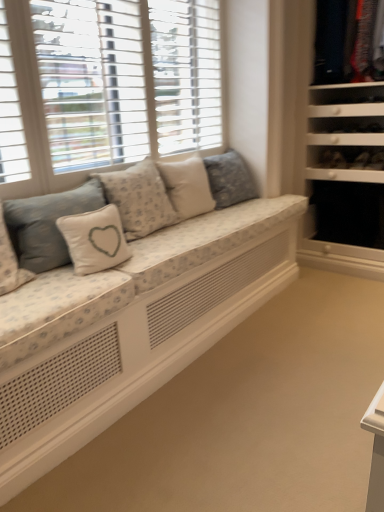
Question: From the image's perspective, is fluffy white pillow at center, which is the first pillow from right to left, located above black fabric drawer at right?

Choices:
 (A) yes
 (B) no

Answer: (A)

Question: Can you confirm if fluffy white pillow at center, which is the first pillow from right to left, is thinner than black fabric drawer at right?

Choices:
 (A) yes
 (B) no

Answer: (A)

Question: From the image's perspective, is fluffy white pillow at center, the fifth pillow viewed from the left, located beneath black fabric drawer at right?

Choices:
 (A) no
 (B) yes

Answer: (A)

Question: Is fluffy white pillow at center, which is the first pillow from right to left, positioned with its back to black fabric drawer at right?

Choices:
 (A) yes
 (B) no

Answer: (B)

Question: Does fluffy white pillow at center, the fifth pillow viewed from the left, lie in front of black fabric drawer at right?

Choices:
 (A) yes
 (B) no

Answer: (A)

Question: Is white fabric pillow at center, positioned as the 3th pillow in left-to-right order, bigger or smaller than fluffy white pillow at center, which is the first pillow from right to left?

Choices:
 (A) small
 (B) big

Answer: (A)

Question: From a real-world perspective, is white fabric pillow at center, positioned as the 3th pillow in left-to-right order, positioned above or below fluffy white pillow at center, the fifth pillow viewed from the left?

Choices:
 (A) below
 (B) above

Answer: (B)

Question: From the image's perspective, is white fabric pillow at center, the third pillow positioned from the right, located above or below fluffy white pillow at center, which is the first pillow from right to left?

Choices:
 (A) below
 (B) above

Answer: (A)

Question: From their relative heights in the image, would you say white fabric pillow at center, positioned as the 3th pillow in left-to-right order, is taller or shorter than fluffy white pillow at center, which is the first pillow from right to left?

Choices:
 (A) short
 (B) tall

Answer: (A)

Question: Considering the positions of black fabric drawer at right and white textured shutters at upper left in the image, is black fabric drawer at right taller or shorter than white textured shutters at upper left?

Choices:
 (A) tall
 (B) short

Answer: (B)

Question: Would you say black fabric drawer at right is inside or outside white textured shutters at upper left?

Choices:
 (A) outside
 (B) inside

Answer: (A)

Question: Considering the positions of point (372, 227) and point (51, 156), is point (372, 227) closer or farther from the camera than point (51, 156)?

Choices:
 (A) farther
 (B) closer

Answer: (A)

Question: Considering the positions of black fabric drawer at right and white textured shutters at upper left in the image, is black fabric drawer at right wider or thinner than white textured shutters at upper left?

Choices:
 (A) wide
 (B) thin

Answer: (A)

Question: Considering the positions of floral fabric studio couch at center and white fabric pillow with heart design at center, the 4th pillow in the right-to-left sequence, in the image, is floral fabric studio couch at center wider or thinner than white fabric pillow with heart design at center, the 4th pillow in the right-to-left sequence,?

Choices:
 (A) thin
 (B) wide

Answer: (B)

Question: Considering the positions of floral fabric studio couch at center and white fabric pillow with heart design at center, which is the second pillow in left-to-right order, in the image, is floral fabric studio couch at center taller or shorter than white fabric pillow with heart design at center, which is the second pillow in left-to-right order,?

Choices:
 (A) short
 (B) tall

Answer: (A)